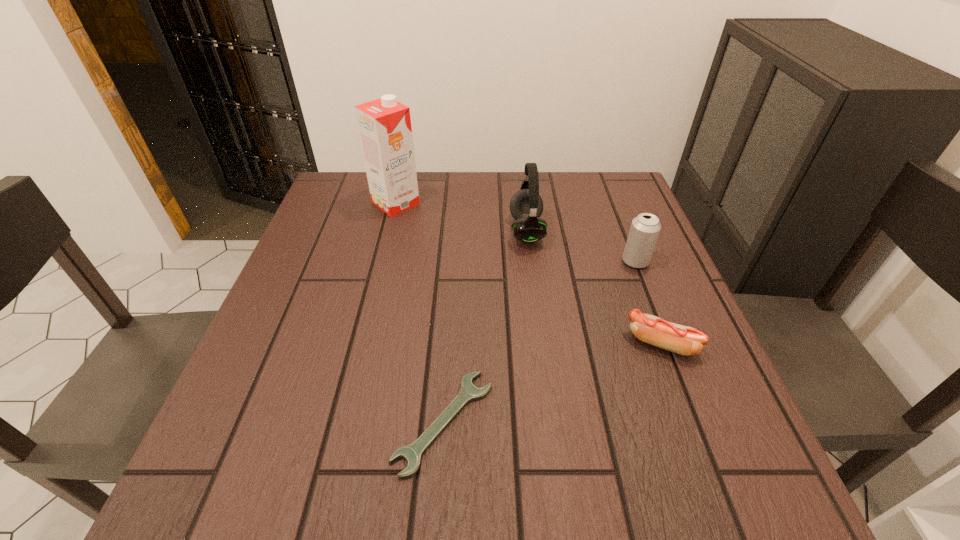
At what (x,y) coordinates should I click in order to perform the action: click on free region located on the front of the tallest object. Please return your answer as a coordinate pair (x, y). Image resolution: width=960 pixels, height=540 pixels. Looking at the image, I should click on (378, 274).

At what (x,y) coordinates should I click in order to perform the action: click on free space located 0.330m on the ear cups of the headset. Please return your answer as a coordinate pair (x, y). Looking at the image, I should click on (377, 231).

This screenshot has width=960, height=540. Identify the location of vacant space located 0.110m on the ear cups of the headset. (466, 231).

Identify the location of vacant space located on the ear cups of the headset. (414, 231).

I want to click on vacant space located on the front of the beer can, so click(x=646, y=289).

Find the location of `vacant space situated on the back of the sausage`. vacant space situated on the back of the sausage is located at coordinates (622, 241).

You are a GUI agent. You are given a task and a screenshot of the screen. Output one action in this format:
    pyautogui.click(x=<x>, y=<y>)
    Task: Click on the free space located 0.180m on the right of the wrench
    
    Given the screenshot: What is the action you would take?
    pyautogui.click(x=602, y=422)

Where is `carton at the far edge`? carton at the far edge is located at coordinates (384, 125).

Where is `headset present at the far edge`? This screenshot has width=960, height=540. headset present at the far edge is located at coordinates (526, 206).

Identify the location of object that is at the near edge. The height and width of the screenshot is (540, 960). (412, 453).